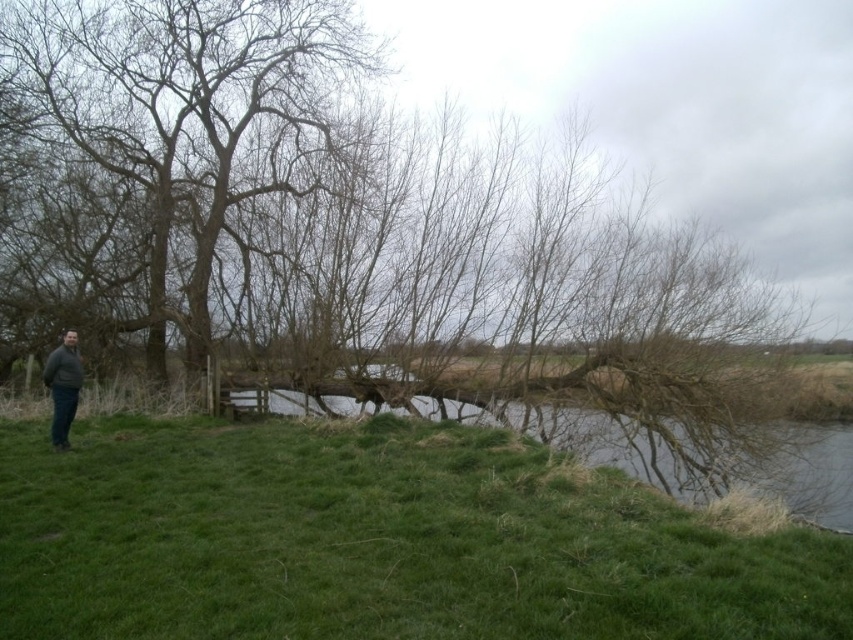
Question: Can you confirm if green grassy at lower left is bigger than bare wood tree at left?

Choices:
 (A) yes
 (B) no

Answer: (A)

Question: In this image, where is bare wood tree at left located relative to brown grassy river at center?

Choices:
 (A) below
 (B) above

Answer: (B)

Question: Among these points, which one is farthest from the camera?

Choices:
 (A) 291,8
 (B) 254,580
 (C) 439,408

Answer: (A)

Question: Which point is closer to the camera taking this photo?

Choices:
 (A) (57, 374)
 (B) (99, 420)
 (C) (305, 72)
 (D) (239, 403)

Answer: (A)

Question: Can you confirm if brown grassy river at center is positioned to the left of dark gray sweater at lower left?

Choices:
 (A) no
 (B) yes

Answer: (A)

Question: Among these objects, which one is farthest from the camera?

Choices:
 (A) dark gray sweater at lower left
 (B) bare wood tree at left
 (C) green grassy at lower left
 (D) brown grassy river at center

Answer: (B)